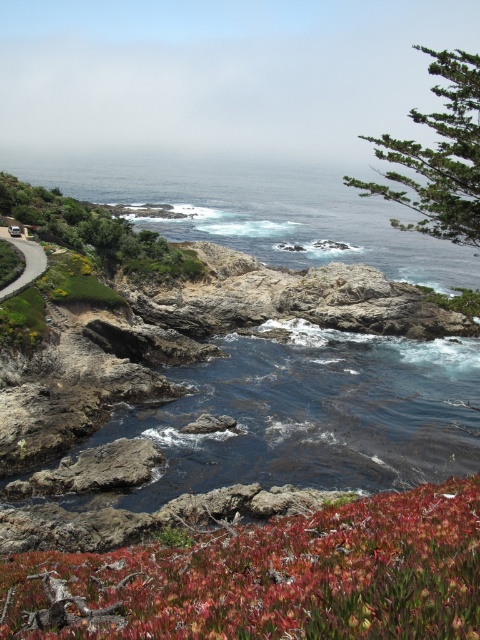
Is green matte plant at center taller than green leafy shrubs at upper left?

Incorrect, green matte plant at center's height is not larger of green leafy shrubs at upper left's.

Describe the element at coordinates (269, 577) in the screenshot. This screenshot has width=480, height=640. I see `green matte plant at center` at that location.

You are a GUI agent. You are given a task and a screenshot of the screen. Output one action in this format:
    pyautogui.click(x=<x>, y=<y>)
    Task: Click on the green matte plant at center
    This screenshot has height=640, width=480.
    Given the screenshot: What is the action you would take?
    pyautogui.click(x=269, y=577)

Who is higher up, blue water at center or green leafy tree at upper right?

green leafy tree at upper right is higher up.

Does blue water at center have a lesser height compared to green leafy tree at upper right?

Yes.

Is point (276, 166) less distant than point (432, 225)?

No, it is not.

You are a GUI agent. You are given a task and a screenshot of the screen. Output one action in this format:
    pyautogui.click(x=<x>, y=<y>)
    Task: Click on the blue water at center
    
    Given the screenshot: What is the action you would take?
    tap(261, 212)

Which is more to the left, blue water at center or matte asphalt road at left?

From the viewer's perspective, blue water at center appears more on the left side.

Is blue water at center taller than matte asphalt road at left?

Correct, blue water at center is much taller as matte asphalt road at left.

What are the coordinates of `blue water at center` in the screenshot? It's located at (261, 212).